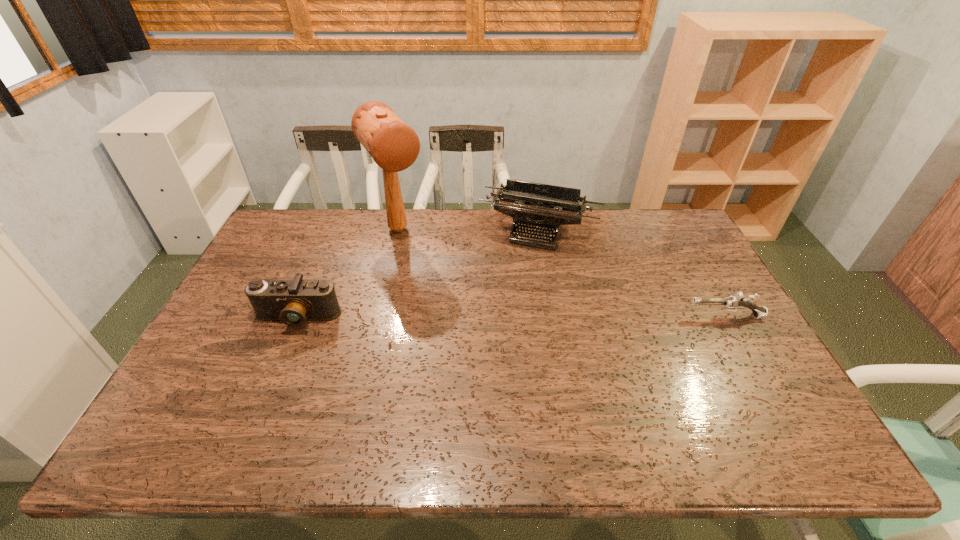
In the image, there is a desktop. At what (x,y) coordinates should I click in order to perform the action: click on vacant space at the far edge. Please return your answer as a coordinate pair (x, y). Image resolution: width=960 pixels, height=540 pixels. Looking at the image, I should click on (626, 231).

Image resolution: width=960 pixels, height=540 pixels. I want to click on vacant area at the near edge, so click(x=291, y=400).

Identify the location of free location at the left edge. pyautogui.click(x=289, y=264).

Find the location of a particular element. The image size is (960, 540). free space at the right edge of the desktop is located at coordinates (700, 355).

Find the location of a particular element. The image size is (960, 540). free region at the near left corner is located at coordinates (x=188, y=392).

In the image, there is a desktop. Where is `free region at the far right corner`? The image size is (960, 540). free region at the far right corner is located at coordinates (692, 238).

This screenshot has width=960, height=540. In order to click on empty location between the third tallest object and the third shortest object in this screenshot , I will do `click(419, 274)`.

The image size is (960, 540). I want to click on free spot between the typewriter and the shortest object, so click(x=633, y=273).

What are the coordinates of `vacant space in between the tallest object and the second tallest object` in the screenshot? It's located at (468, 230).

Find the location of `empty space that is in between the mallet and the camera`. empty space that is in between the mallet and the camera is located at coordinates (348, 273).